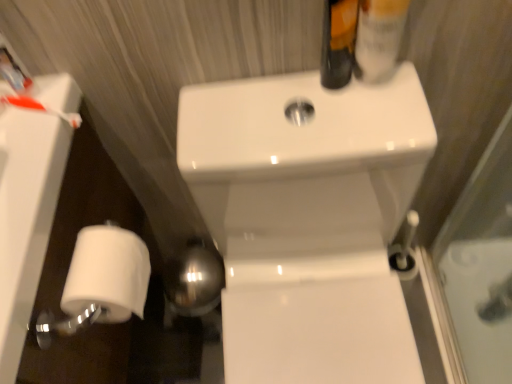
Question: Considering the positions of point (259, 165) and point (376, 18), is point (259, 165) closer or farther from the camera than point (376, 18)?

Choices:
 (A) closer
 (B) farther

Answer: (B)

Question: From their relative heights in the image, would you say white glossy sink at center is taller or shorter than translucent plastic mouthwash at upper right?

Choices:
 (A) tall
 (B) short

Answer: (A)

Question: Which is farther from the white glossy sink at center?

Choices:
 (A) matte black bottle at upper right
 (B) white matte toilet paper at lower left
 (C) white matte toilet paper at lower left
 (D) translucent plastic mouthwash at upper right

Answer: (B)

Question: Which of these objects is positioned farthest from the matte black bottle at upper right?

Choices:
 (A) white matte toilet paper at lower left
 (B) translucent plastic mouthwash at upper right
 (C) white glossy sink at center
 (D) white matte toilet paper at lower left

Answer: (A)